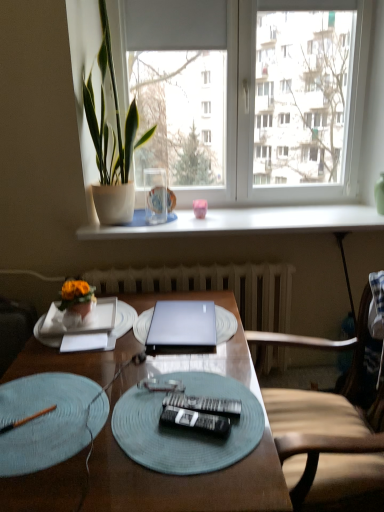
Where is `vacant space in between silver metallic laptop at center and black plastic remote control at center, which is counted as the first remote control, starting from the back`? The width and height of the screenshot is (384, 512). vacant space in between silver metallic laptop at center and black plastic remote control at center, which is counted as the first remote control, starting from the back is located at coordinates 195,373.